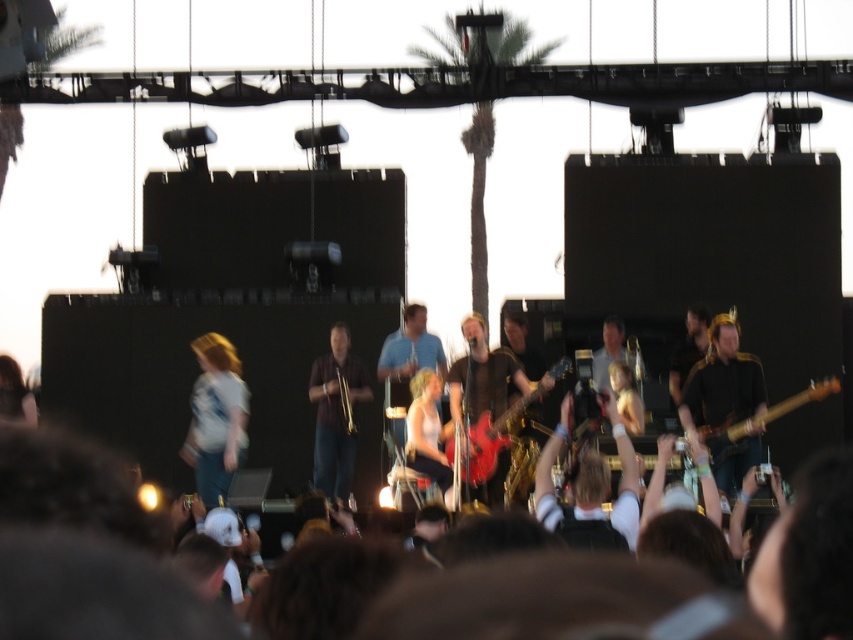
Question: Does shiny red electric guitar at center have a smaller size compared to brown wooden guitar at right?

Choices:
 (A) yes
 (B) no

Answer: (A)

Question: Which point is closer to the camera?

Choices:
 (A) brown wooden guitar at right
 (B) shiny red electric guitar at center

Answer: (A)

Question: Observing the image, what is the correct spatial positioning of shiny red electric guitar at center in reference to brown wooden guitar at right?

Choices:
 (A) above
 (B) below

Answer: (A)

Question: Is shiny red electric guitar at center positioned in front of brown wooden guitar at right?

Choices:
 (A) no
 (B) yes

Answer: (A)